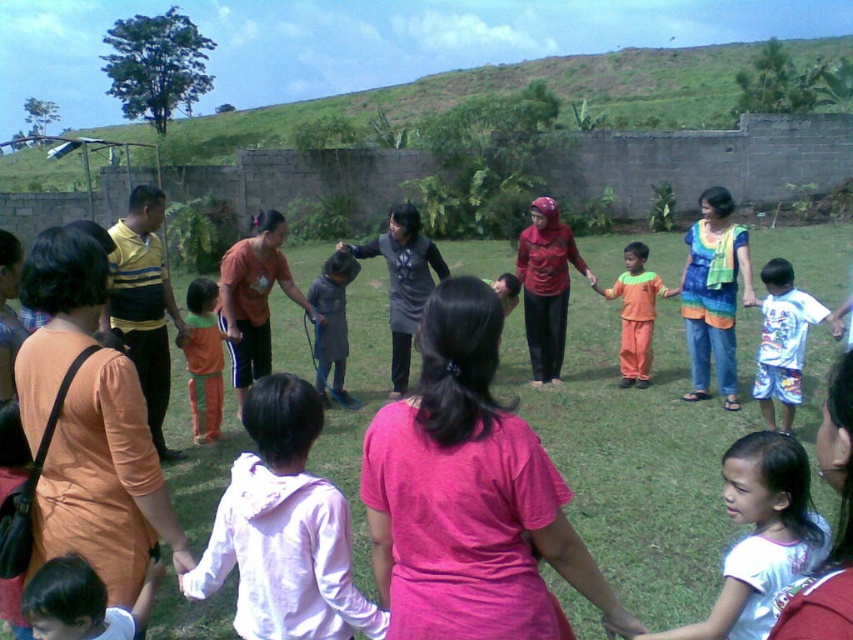
Between white cotton hoodie at center and white cotton shirt at lower left, which one appears on the right side from the viewer's perspective?

Positioned to the right is white cotton hoodie at center.

Is white cotton hoodie at center to the left of white cotton shirt at lower left from the viewer's perspective?

Incorrect, white cotton hoodie at center is not on the left side of white cotton shirt at lower left.

Between point (293, 548) and point (65, 605), which one is positioned behind?

The point (65, 605) is behind.

Identify the location of white cotton hoodie at center. This screenshot has width=853, height=640. (283, 529).

Which of these two, orange cotton pants at lower left or dark gray fabric dress at center, stands shorter?

orange cotton pants at lower left

Is point (190, 385) positioned after point (321, 348)?

That is False.

Locate an element on the screen. The image size is (853, 640). orange cotton pants at lower left is located at coordinates (202, 358).

Measure the distance between point (640,481) and camera.

Point (640,481) and camera are 5.64 meters apart from each other.

Based on the photo, which of these two, green grass at center or orange cotton pants at lower left, stands taller?

With more height is green grass at center.

Where is `green grass at center`? green grass at center is located at coordinates (637, 452).